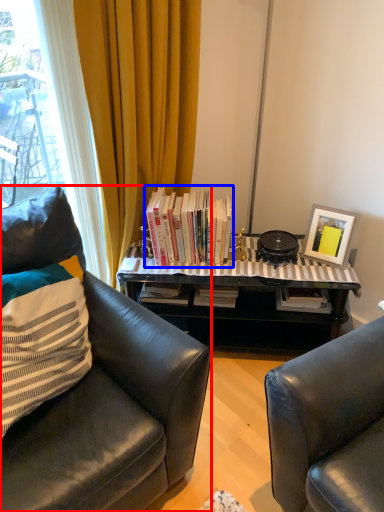
Question: Which point is closer to the camera, chair (highlighted by a red box) or book (highlighted by a blue box)?

Choices:
 (A) chair
 (B) book

Answer: (A)